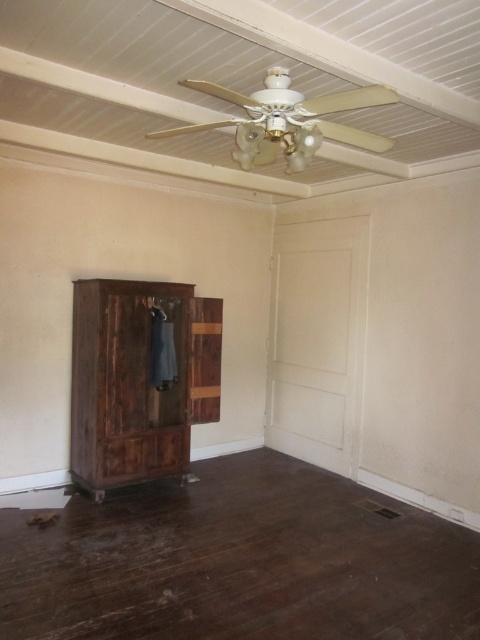
Question: Among these points, which one is nearest to the camera?

Choices:
 (A) (187, 332)
 (B) (165, 316)

Answer: (B)

Question: Is dark brown wood armoire at left smaller than denim hanger at left?

Choices:
 (A) no
 (B) yes

Answer: (A)

Question: Does dark brown wood armoire at left appear under denim hanger at left?

Choices:
 (A) no
 (B) yes

Answer: (B)

Question: Does dark brown wood armoire at left appear on the left side of denim hanger at left?

Choices:
 (A) yes
 (B) no

Answer: (A)

Question: Which point appears closest to the camera in this image?

Choices:
 (A) (103, 474)
 (B) (153, 300)

Answer: (A)